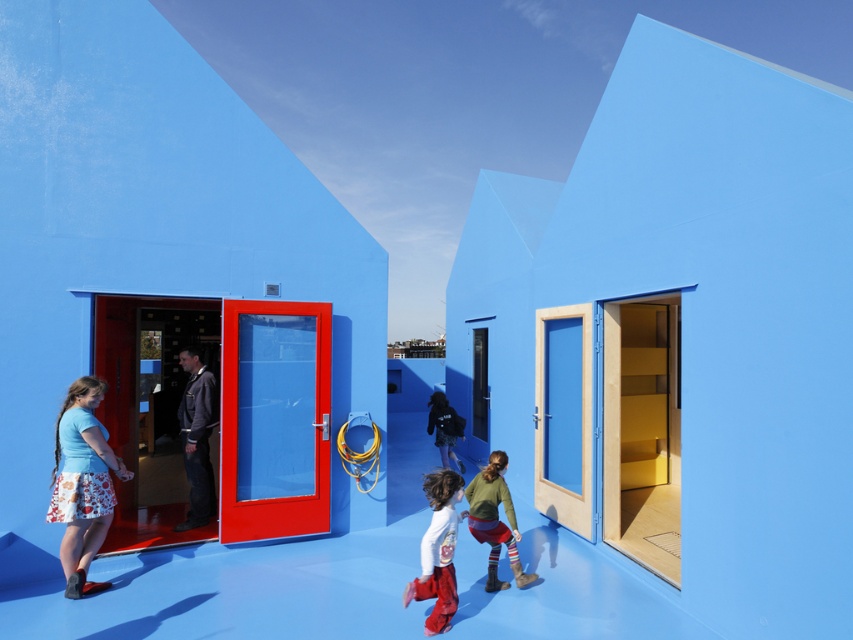
You are a photographer standing in front of the blue building. You see two children wearing the matte white shirt at center and the matte black jacket at center. Which child is wearing the narrower clothing item?

The matte white shirt at center has a lesser width compared to the matte black jacket at center, so the child wearing the matte white shirt at center has the narrower clothing item.

You are a photographer standing in front of the building and want to capture both the floral cotton skirt at lower left and the matte black jacket at center in a single shot. Considering their sizes, which object should you focus on to ensure both fit in the frame?

The floral cotton skirt at lower left is wider than the matte black jacket at center, so focusing on the wider floral cotton skirt at lower left will help ensure both objects fit within the frame.